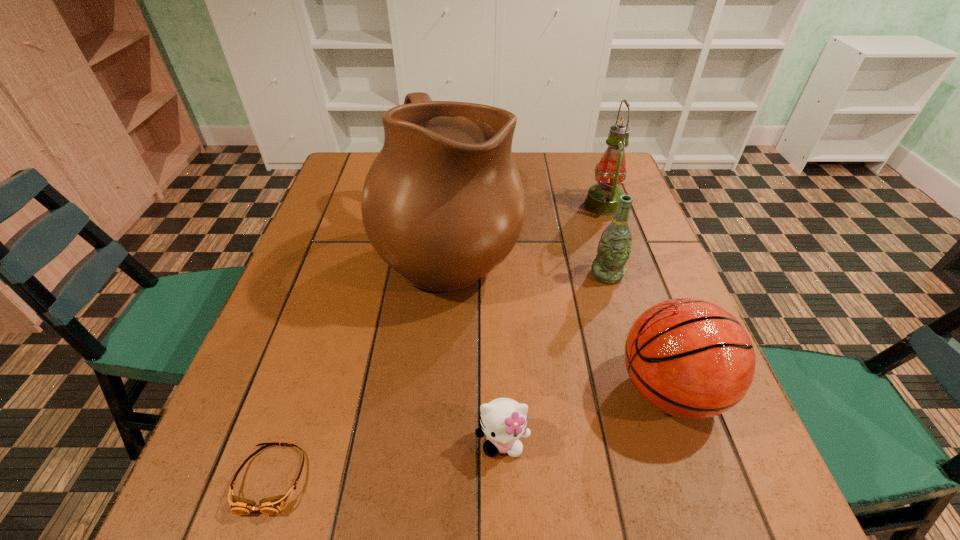
The width and height of the screenshot is (960, 540). What are the coordinates of `object present at the near left corner` in the screenshot? It's located at point(273,505).

At what (x,y) coordinates should I click in order to perform the action: click on object located in the far right corner section of the desktop. Please return your answer as a coordinate pair (x, y). Looking at the image, I should click on (602, 198).

In the image, there is a desktop. At what (x,y) coordinates should I click in order to perform the action: click on vacant area at the far edge. Please return your answer as a coordinate pair (x, y). The height and width of the screenshot is (540, 960). Looking at the image, I should click on (556, 170).

Where is `free space at the near edge`? The width and height of the screenshot is (960, 540). free space at the near edge is located at coordinates (323, 518).

You are a GUI agent. You are given a task and a screenshot of the screen. Output one action in this format:
    pyautogui.click(x=<x>, y=<y>)
    Task: Click on the vacant region at the left edge of the desktop
    
    Given the screenshot: What is the action you would take?
    pyautogui.click(x=299, y=271)

The height and width of the screenshot is (540, 960). In the image, there is a desktop. What are the coordinates of `vacant space at the right edge` in the screenshot? It's located at click(675, 284).

Locate an element on the screen. This screenshot has width=960, height=540. unoccupied position between the kitten and the second tallest object is located at coordinates pyautogui.click(x=553, y=323).

The width and height of the screenshot is (960, 540). I want to click on vacant space that is in between the kitten and the fifth shortest object, so click(x=553, y=323).

This screenshot has height=540, width=960. Find the location of `vacant space that's between the tallest object and the basketball`. vacant space that's between the tallest object and the basketball is located at coordinates [x=560, y=319].

This screenshot has width=960, height=540. Find the location of `free spot between the shortest object and the tallest object`. free spot between the shortest object and the tallest object is located at coordinates (360, 364).